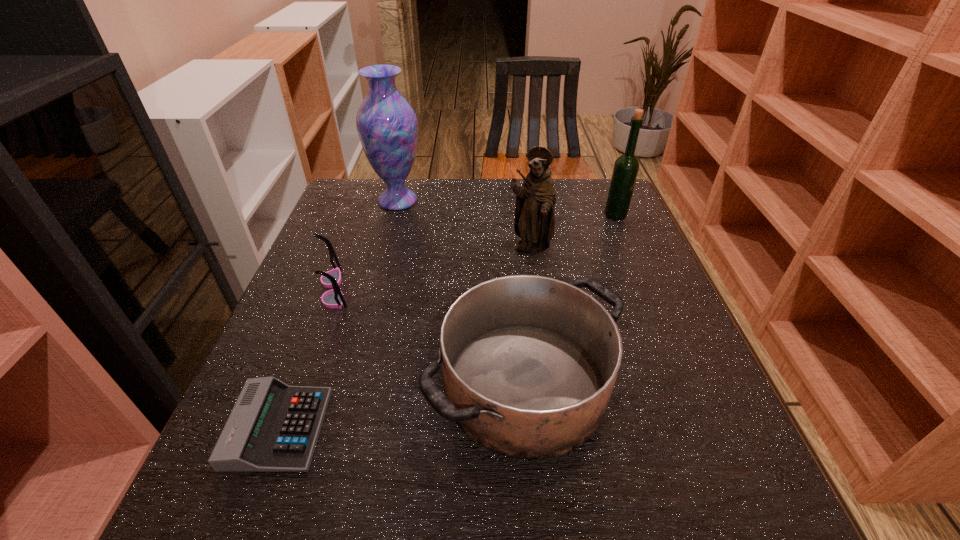
The height and width of the screenshot is (540, 960). What are the coordinates of `the tallest object` in the screenshot? It's located at (386, 123).

Where is `the rightmost object`? The image size is (960, 540). the rightmost object is located at coordinates (626, 167).

This screenshot has height=540, width=960. I want to click on figurine, so click(534, 223).

This screenshot has height=540, width=960. Find the location of `saucepan`. saucepan is located at coordinates (529, 363).

What are the coordinates of `the fourth farthest object` in the screenshot? It's located at click(333, 298).

The width and height of the screenshot is (960, 540). I want to click on spectacles, so click(333, 298).

Find the location of a particular element. The image size is (960, 540). the shortest object is located at coordinates (273, 427).

Identify the location of free region located on the right of the vase. (506, 201).

Locate an element on the screen. The image size is (960, 540). vacant space located 0.390m on the left of the rightmost object is located at coordinates (461, 215).

Find the location of a particular element. The width and height of the screenshot is (960, 540). vacant region located 0.270m on the front-facing side of the third farthest object is located at coordinates (544, 353).